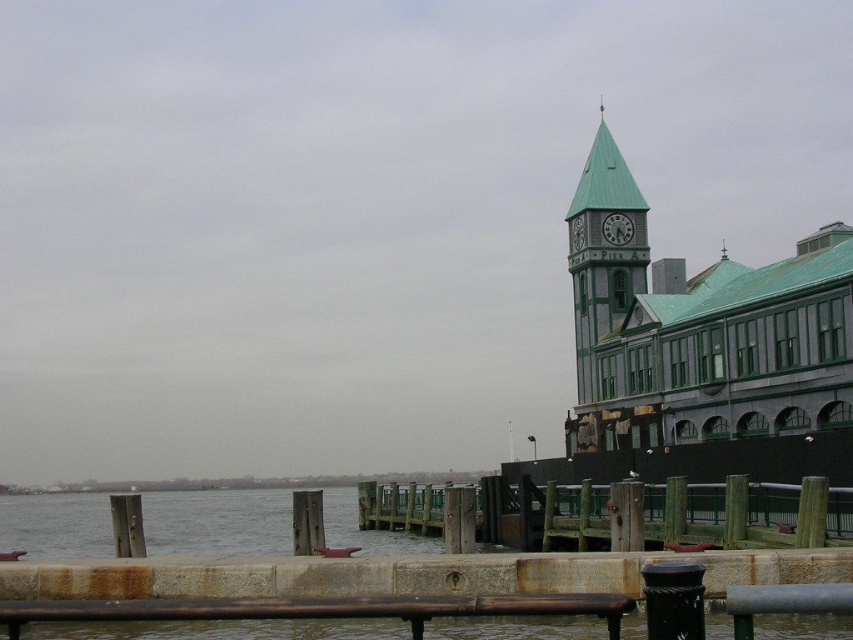
Question: Is wooden at lower center closer to camera compared to rusty metal rail at lower center?

Choices:
 (A) yes
 (B) no

Answer: (B)

Question: Which point is farther to the camera?

Choices:
 (A) green metallic clock at upper center
 (B) rusty metal rail at lower center

Answer: (A)

Question: Is rusty metal rail at lower center in front of green metallic clock at upper center?

Choices:
 (A) no
 (B) yes

Answer: (B)

Question: Which of the following is the closest to the observer?

Choices:
 (A) (210, 490)
 (B) (581, 236)

Answer: (B)

Question: Does wooden at lower center appear on the left side of rusty metal rail at lower center?

Choices:
 (A) yes
 (B) no

Answer: (B)

Question: Among these objects, which one is farthest from the camera?

Choices:
 (A) rusty metal rail at lower center
 (B) green metallic clock at upper center
 (C) wooden at lower center

Answer: (B)